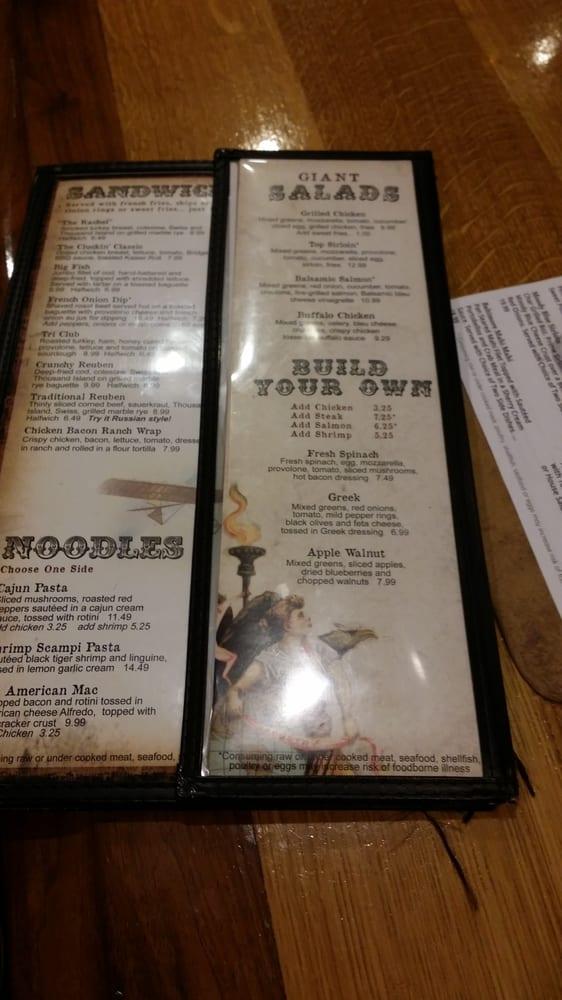
This screenshot has height=1000, width=562. I want to click on wood table, so click(504, 135), click(123, 76).